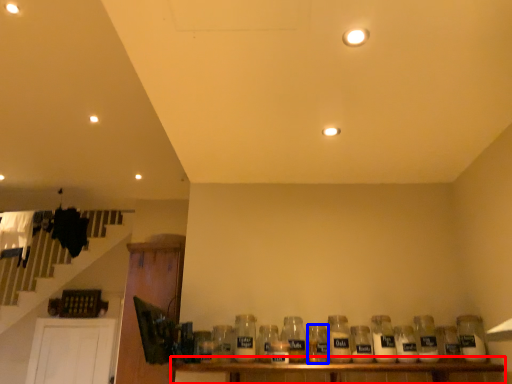
Question: Which of the following is the farthest to the observer, table (highlighted by a red box) or bottle (highlighted by a blue box)?

Choices:
 (A) table
 (B) bottle

Answer: (B)